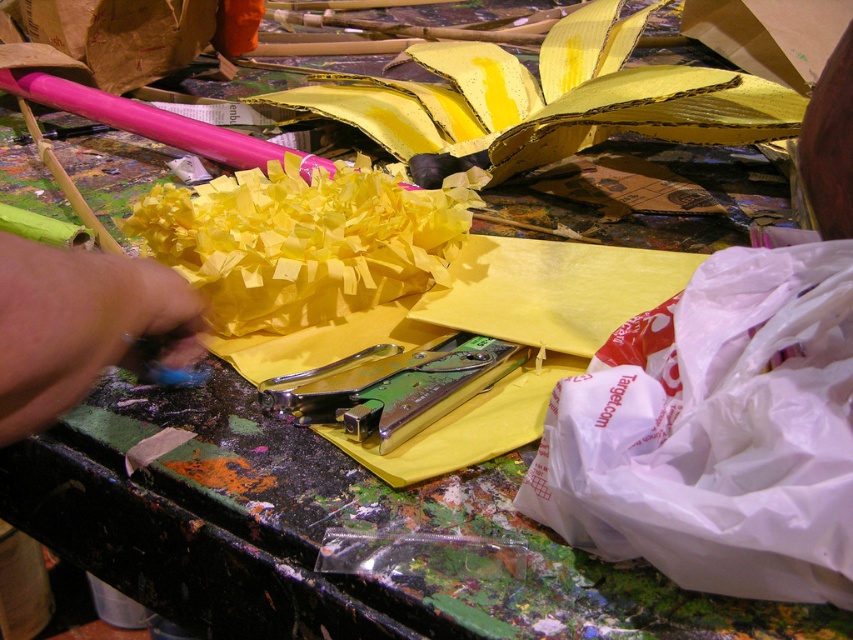
Is blue fabric hand at lower left closer to camera compared to metallic green stapler at center?

That is True.

Does point (148, 310) come in front of point (267, 397)?

Yes, it is.

Does point (173, 349) come in front of point (276, 410)?

Yes, point (173, 349) is closer to viewer.

Identify the location of blue fabric hand at lower left. This screenshot has width=853, height=640. (80, 324).

Which of these two, white plastic bag at lower right or metallic green stapler at center, stands shorter?

With less height is metallic green stapler at center.

This screenshot has width=853, height=640. Identify the location of white plastic bag at lower right. (718, 435).

Is point (822, 422) positioned behind point (283, 385)?

No, it is in front of (283, 385).

Locate an element on the screen. Image resolution: width=853 pixels, height=640 pixels. white plastic bag at lower right is located at coordinates (718, 435).

Is point (836, 436) farther from viewer compared to point (125, 342)?

Yes, it is behind point (125, 342).

Between white plastic bag at lower right and blue fabric hand at lower left, which one appears on the right side from the viewer's perspective?

white plastic bag at lower right

Is point (554, 426) more distant than point (4, 317)?

Yes, point (554, 426) is farther from viewer.

Where is `white plastic bag at lower right`? white plastic bag at lower right is located at coordinates (718, 435).